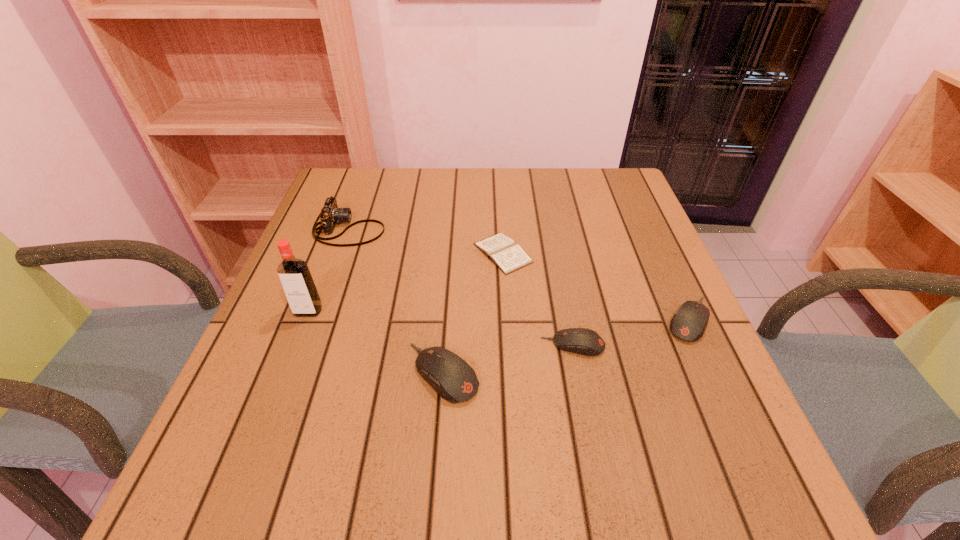
Locate an element on the screen. Image resolution: width=960 pixels, height=540 pixels. free region located on the back of the rightmost object is located at coordinates (670, 279).

You are a GUI agent. You are given a task and a screenshot of the screen. Output one action in this format:
    pyautogui.click(x=<x>, y=<y>)
    Task: Click on the free space located on the right of the diary
    The height and width of the screenshot is (540, 960).
    Given the screenshot: What is the action you would take?
    [557, 253]

In order to click on free spot located on the front-facing side of the camera in this screenshot , I will do `click(404, 228)`.

Identify the location of blank space located on the front and back of the tallest object. This screenshot has height=540, width=960. (289, 361).

I want to click on object located in the far edge section of the desktop, so click(x=330, y=214).

Identify the location of object present at the near edge. This screenshot has width=960, height=540. (449, 375).

In order to click on camera that is positioned at the left edge in this screenshot , I will do `click(330, 214)`.

Locate an element on the screen. vodka that is positioned at the left edge is located at coordinates (295, 277).

Locate an element on the screen. The image size is (960, 540). object present at the right edge is located at coordinates (689, 322).

You are a GUI agent. You are given a task and a screenshot of the screen. Output one action in this format:
    pyautogui.click(x=<x>, y=<y>)
    Task: Click on the object that is at the far left corner
    The height and width of the screenshot is (540, 960).
    Given the screenshot: What is the action you would take?
    pyautogui.click(x=330, y=214)